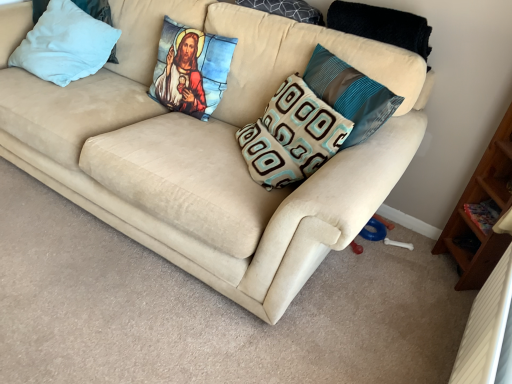
Question: Is brown and light blue patterned pillow at center, placed as the third pillow when sorted from left to right, at the left side of stained glass pillow at upper center, the second pillow viewed from the left?

Choices:
 (A) yes
 (B) no

Answer: (B)

Question: Considering the relative sizes of brown and light blue patterned pillow at center, marked as the third pillow in a right-to-left arrangement, and stained glass pillow at upper center, the second pillow viewed from the left, in the image provided, is brown and light blue patterned pillow at center, marked as the third pillow in a right-to-left arrangement, shorter than stained glass pillow at upper center, the second pillow viewed from the left,?

Choices:
 (A) no
 (B) yes

Answer: (B)

Question: Is brown and light blue patterned pillow at center, placed as the third pillow when sorted from left to right, positioned behind stained glass pillow at upper center, the second pillow viewed from the left?

Choices:
 (A) yes
 (B) no

Answer: (B)

Question: Is brown and light blue patterned pillow at center, placed as the third pillow when sorted from left to right, looking in the opposite direction of stained glass pillow at upper center, marked as the fourth pillow in a right-to-left arrangement?

Choices:
 (A) yes
 (B) no

Answer: (B)

Question: From a real-world perspective, is brown and light blue patterned pillow at center, marked as the third pillow in a right-to-left arrangement, beneath stained glass pillow at upper center, the second pillow viewed from the left?

Choices:
 (A) no
 (B) yes

Answer: (B)

Question: Is stained glass pillow at upper center, marked as the fourth pillow in a right-to-left arrangement, in front of or behind teal-patterned cushion at center-right, the 1th pillow from the right, in the image?

Choices:
 (A) front
 (B) behind

Answer: (B)

Question: In terms of width, does stained glass pillow at upper center, the second pillow viewed from the left, look wider or thinner when compared to teal-patterned cushion at center-right, the fifth pillow positioned from the left?

Choices:
 (A) wide
 (B) thin

Answer: (A)

Question: Is stained glass pillow at upper center, the second pillow viewed from the left, inside or outside of teal-patterned cushion at center-right, the fifth pillow positioned from the left?

Choices:
 (A) inside
 (B) outside

Answer: (B)

Question: Based on their sizes in the image, would you say stained glass pillow at upper center, the second pillow viewed from the left, is bigger or smaller than teal-patterned cushion at center-right, the 1th pillow from the right?

Choices:
 (A) big
 (B) small

Answer: (B)

Question: In terms of width, does teal-patterned cushion at center-right, the fifth pillow positioned from the left, look wider or thinner when compared to brown and light blue patterned pillow at center, placed as the third pillow when sorted from left to right?

Choices:
 (A) wide
 (B) thin

Answer: (B)

Question: Relative to brown and light blue patterned pillow at center, placed as the third pillow when sorted from left to right, is teal-patterned cushion at center-right, the 1th pillow from the right, in front or behind?

Choices:
 (A) front
 (B) behind

Answer: (A)

Question: In terms of height, does teal-patterned cushion at center-right, the 1th pillow from the right, look taller or shorter compared to brown and light blue patterned pillow at center, marked as the third pillow in a right-to-left arrangement?

Choices:
 (A) short
 (B) tall

Answer: (B)

Question: Is teal-patterned cushion at center-right, the fifth pillow positioned from the left, inside the boundaries of brown and light blue patterned pillow at center, marked as the third pillow in a right-to-left arrangement, or outside?

Choices:
 (A) outside
 (B) inside

Answer: (A)

Question: Considering the relative positions of stained glass pillow at upper center, marked as the fourth pillow in a right-to-left arrangement, and light blue fabric pillow at upper left, the fifth pillow in the right-to-left sequence, in the image provided, is stained glass pillow at upper center, marked as the fourth pillow in a right-to-left arrangement, to the left or to the right of light blue fabric pillow at upper left, the fifth pillow in the right-to-left sequence,?

Choices:
 (A) left
 (B) right

Answer: (B)

Question: From a real-world perspective, relative to light blue fabric pillow at upper left, which is the 1th pillow in left-to-right order, is stained glass pillow at upper center, the second pillow viewed from the left, vertically above or below?

Choices:
 (A) below
 (B) above

Answer: (B)